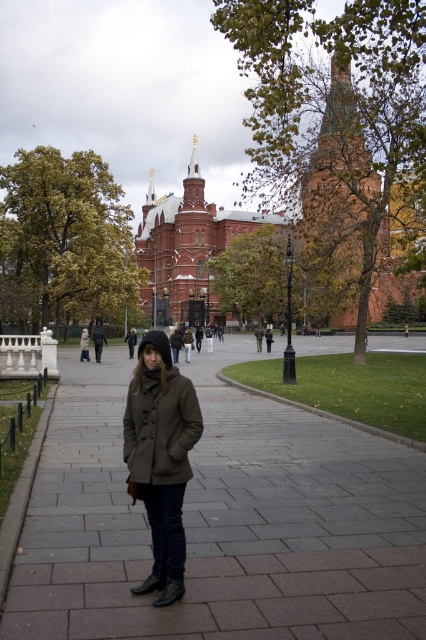
Question: Estimate the real-world distances between objects in this image. Which object is closer to the brown woolen coat at center?

Choices:
 (A) olive green wool coat at center
 (B) matte brown coat at center
 (C) smooth concrete pavement at center

Answer: (C)

Question: Which point is farther to the camera?

Choices:
 (A) (170, 442)
 (B) (132, 522)
 (C) (143, 442)

Answer: (B)

Question: Where is smooth concrete pavement at center located in relation to olive green wool coat at center in the image?

Choices:
 (A) above
 (B) below

Answer: (B)

Question: Does olive green wool coat at center have a lesser width compared to brown woolen coat at center?

Choices:
 (A) yes
 (B) no

Answer: (B)

Question: Does matte brown coat at center have a lesser width compared to brown woolen coat at center?

Choices:
 (A) no
 (B) yes

Answer: (A)

Question: Considering the real-world distances, which object is closest to the matte brown coat at center?

Choices:
 (A) smooth concrete pavement at center
 (B) olive green wool coat at center

Answer: (B)